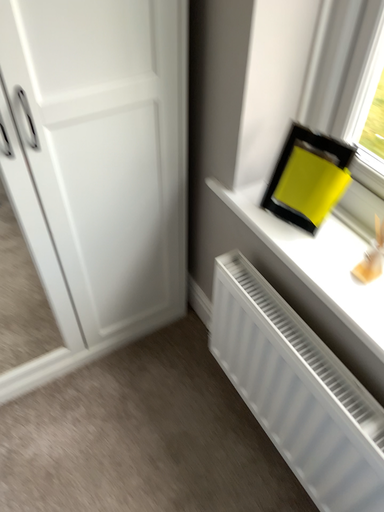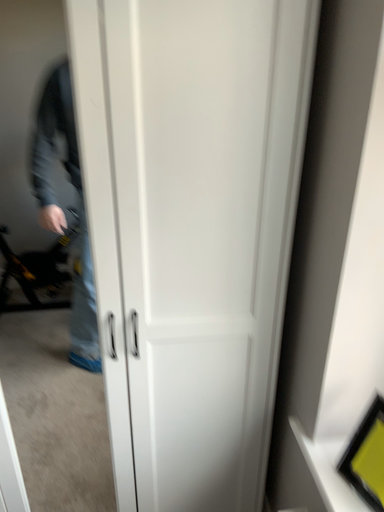
Question: Which way did the camera rotate in the video?

Choices:
 (A) rotated downward
 (B) rotated upward

Answer: (B)